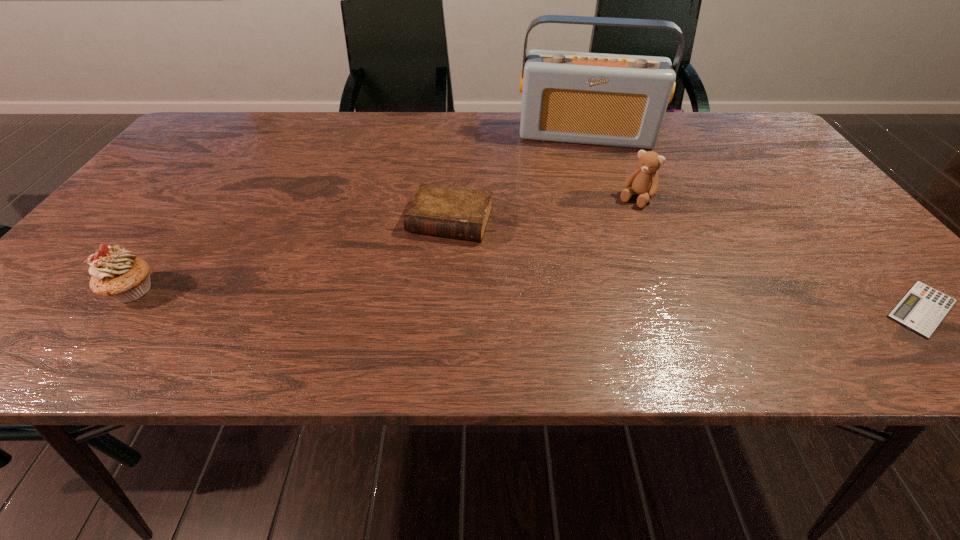
Where is `vacant space at the far edge`? This screenshot has height=540, width=960. vacant space at the far edge is located at coordinates (453, 140).

In the image, there is a desktop. Identify the location of vacant space at the near edge. The height and width of the screenshot is (540, 960). (667, 307).

Where is `vacant space at the left edge of the desktop`? vacant space at the left edge of the desktop is located at coordinates (87, 258).

The width and height of the screenshot is (960, 540). In the image, there is a desktop. Find the location of `vacant space at the right edge`. vacant space at the right edge is located at coordinates (807, 210).

You are a GUI agent. You are given a task and a screenshot of the screen. Output one action in this format:
    pyautogui.click(x=<x>, y=<y>)
    Task: Click on the blank space at the far left corner
    Image resolution: width=960 pixels, height=540 pixels.
    Given the screenshot: What is the action you would take?
    pyautogui.click(x=212, y=132)

In the image, there is a desktop. Where is `free space at the far right corner`? This screenshot has height=540, width=960. free space at the far right corner is located at coordinates (733, 124).

The width and height of the screenshot is (960, 540). I want to click on vacant space that's between the tallest object and the cupcake, so click(x=359, y=213).

The image size is (960, 540). I want to click on unoccupied position between the teddy bear and the farthest object, so click(611, 167).

Locate an element on the screen. This screenshot has height=540, width=960. empty space between the cupcake and the fourth object from right to left is located at coordinates (292, 255).

I want to click on free space between the cupcake and the second shortest object, so click(292, 255).